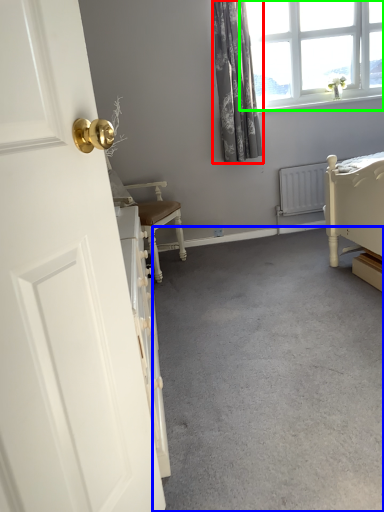
Question: Estimate the real-world distances between objects in this image. Which object is closer to curtain (highlighted by a red box), concrete (highlighted by a blue box) or window (highlighted by a green box)?

Choices:
 (A) concrete
 (B) window

Answer: (B)